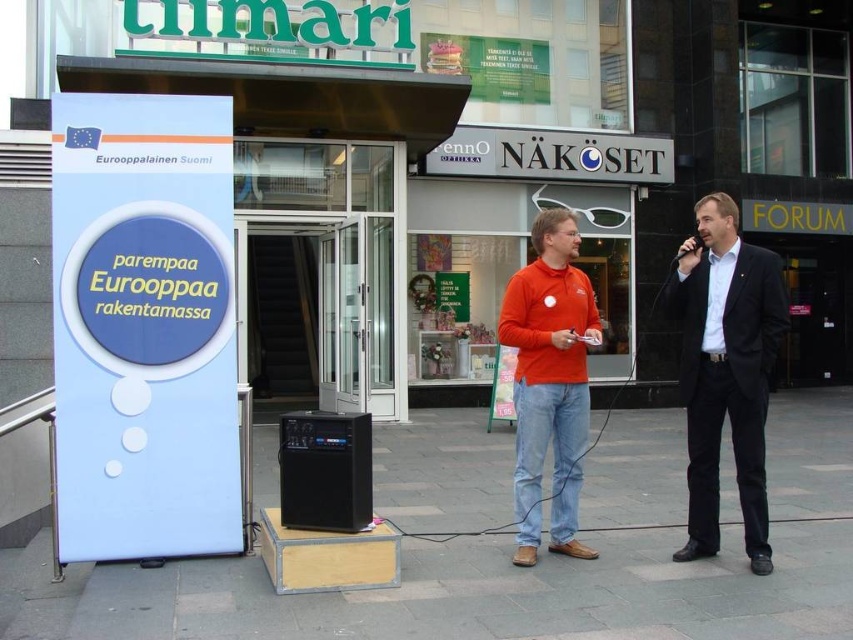
Is dark blue suit at right wider than orange cotton shirt at center?

No, dark blue suit at right is not wider than orange cotton shirt at center.

Which is behind, point (762, 381) or point (548, 371)?

Point (548, 371)

Is point (727, 252) farther from viewer compared to point (577, 237)?

No, (727, 252) is closer to viewer.

At what (x,y) coordinates should I click in order to perform the action: click on dark blue suit at right. Please return your answer as a coordinate pair (x, y). This screenshot has height=640, width=853. Looking at the image, I should click on (726, 371).

I want to click on dark blue suit at right, so [x=726, y=371].

Does dark blue suit at right come in front of black plastic speaker at center?

That is False.

Is point (698, 216) closer to viewer compared to point (328, 467)?

No, (698, 216) is further to viewer.

This screenshot has width=853, height=640. I want to click on dark blue suit at right, so click(x=726, y=371).

Can you confirm if orange cotton shirt at center is wider than black plastic speaker at center?

Indeed, orange cotton shirt at center has a greater width compared to black plastic speaker at center.

What do you see at coordinates (549, 381) in the screenshot? The height and width of the screenshot is (640, 853). I see `orange cotton shirt at center` at bounding box center [549, 381].

Measure the distance between orange cotton shirt at center and camera.

The distance of orange cotton shirt at center from camera is 4.33 meters.

Identify the location of orange cotton shirt at center. Image resolution: width=853 pixels, height=640 pixels. (549, 381).